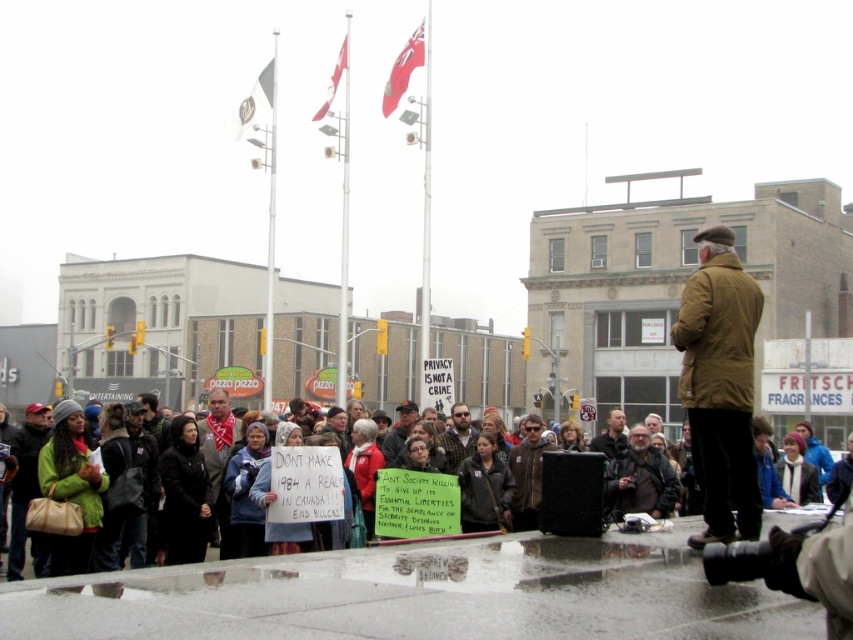
You are a photographer trying to capture the protest scene. You notice the dark gray wool coat at lower left and the bearded man at center. Which object is wider in the image?

The dark gray wool coat at lower left is wider than the bearded man at center according to the description.

You are a photographer trying to capture a photo of the bearded man at center without including the dark gray wool coat at lower left in the frame. Is this possible based on their positions?

The dark gray wool coat at lower left is to the left of the bearded man at center, so if you position yourself to the right side of the bearded man at center, you can avoid including the dark gray wool coat at lower left in the photo.

You are standing at the origin point of the coordinate system in the image. The bearded man at center is at position 0.684 on the x axis and 0.538 on the y axis. Can you determine the direction you need to move to reach him?

The bearded man at center is located at coordinates x 0.684 and y 0.538. Since the origin is at the bottom left corner, you should move to the right and slightly upwards to reach him.